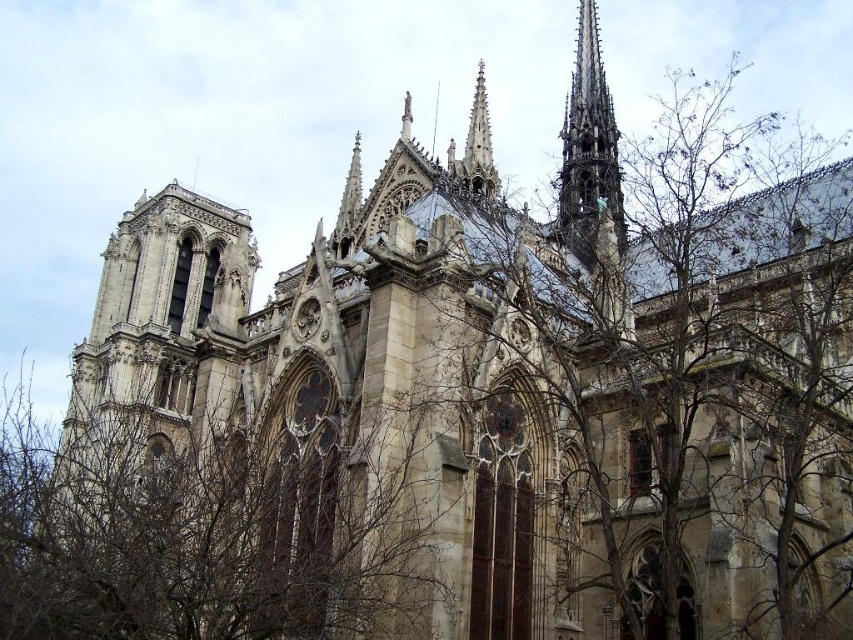
Question: Which object is positioned farthest from the brown leafless branches at lower left?

Choices:
 (A) stone spire at upper right
 (B) smooth stone spire at upper center

Answer: (A)

Question: Which object appears farthest from the camera in this image?

Choices:
 (A) stone spire at upper right
 (B) brown leafless branches at lower left

Answer: (A)

Question: Which of the following is the farthest from the observer?

Choices:
 (A) stone spire at upper right
 (B) smooth stone spire at upper center
 (C) brown leafless branches at lower left

Answer: (A)

Question: From the image, what is the correct spatial relationship of brown leafless branches at lower left in relation to smooth stone spire at upper center?

Choices:
 (A) left
 (B) right

Answer: (A)

Question: Does brown leafless branches at lower left come in front of smooth stone spire at upper center?

Choices:
 (A) no
 (B) yes

Answer: (B)

Question: Is stone spire at upper right to the right of smooth stone spire at upper center from the viewer's perspective?

Choices:
 (A) no
 (B) yes

Answer: (B)